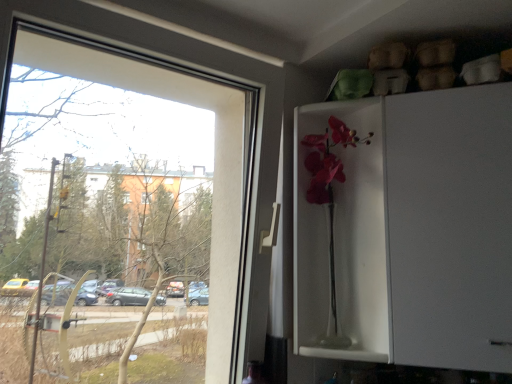
Question: Is white glossy cabinet at upper right smaller than transparent glass window at left?

Choices:
 (A) yes
 (B) no

Answer: (B)

Question: Is white glossy cabinet at upper right at the left side of transparent glass window at left?

Choices:
 (A) no
 (B) yes

Answer: (A)

Question: Does white glossy cabinet at upper right have a lesser width compared to transparent glass window at left?

Choices:
 (A) no
 (B) yes

Answer: (A)

Question: Is white glossy cabinet at upper right closer to camera compared to transparent glass window at left?

Choices:
 (A) yes
 (B) no

Answer: (B)

Question: Is white glossy cabinet at upper right behind transparent glass window at left?

Choices:
 (A) yes
 (B) no

Answer: (A)

Question: Considering the relative sizes of white glossy cabinet at upper right and transparent glass window at left in the image provided, is white glossy cabinet at upper right bigger than transparent glass window at left?

Choices:
 (A) no
 (B) yes

Answer: (B)

Question: From the image's perspective, does matte glass vase at center appear lower than white glossy cabinet at upper right?

Choices:
 (A) no
 (B) yes

Answer: (A)

Question: Considering the relative sizes of matte glass vase at center and white glossy cabinet at upper right in the image provided, is matte glass vase at center shorter than white glossy cabinet at upper right?

Choices:
 (A) no
 (B) yes

Answer: (B)

Question: Does matte glass vase at center lie in front of white glossy cabinet at upper right?

Choices:
 (A) no
 (B) yes

Answer: (A)

Question: Is matte glass vase at center to the left of white glossy cabinet at upper right from the viewer's perspective?

Choices:
 (A) no
 (B) yes

Answer: (B)

Question: Are matte glass vase at center and white glossy cabinet at upper right beside each other?

Choices:
 (A) no
 (B) yes

Answer: (B)

Question: Are matte glass vase at center and white glossy cabinet at upper right located far from each other?

Choices:
 (A) no
 (B) yes

Answer: (A)

Question: Can you confirm if matte glass vase at center is positioned to the right of transparent glass window at left?

Choices:
 (A) no
 (B) yes

Answer: (B)